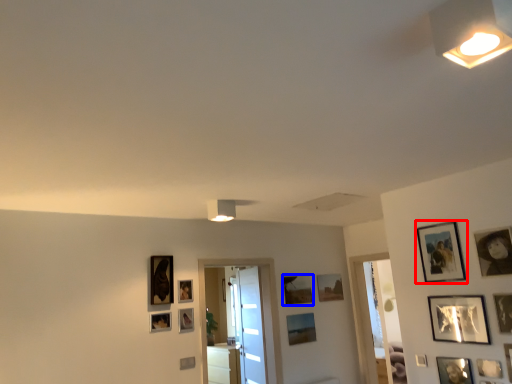
Question: Which of the following is the closest to the observer, picture frame (highlighted by a red box) or picture frame (highlighted by a blue box)?

Choices:
 (A) picture frame
 (B) picture frame

Answer: (A)